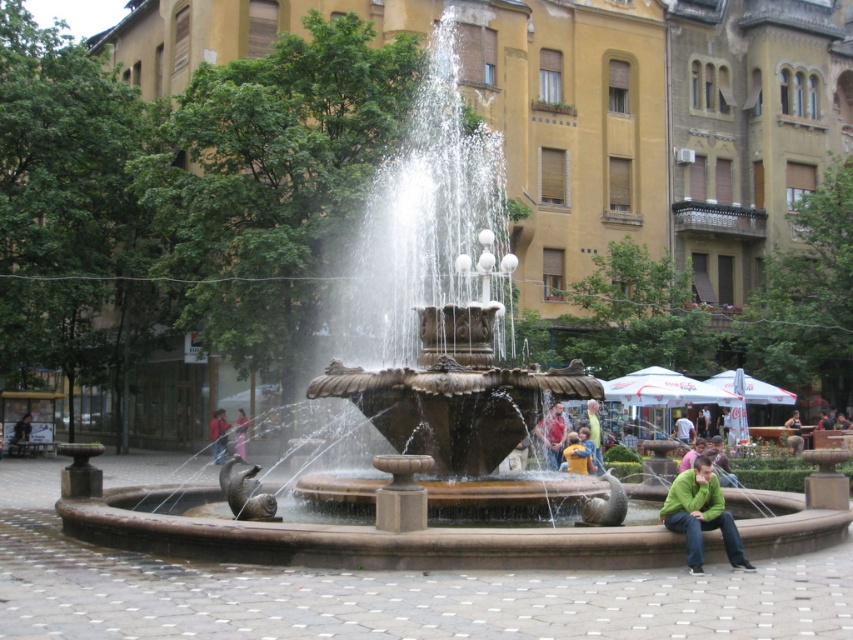
Question: Does matte brown jacket at center come in front of yellow fabric person at lower right?

Choices:
 (A) no
 (B) yes

Answer: (B)

Question: Is yellow fabric person at lower right below red fabric jacket at lower left?

Choices:
 (A) yes
 (B) no

Answer: (B)

Question: Which object is the farthest from the yellow fabric person at lower right?

Choices:
 (A) matte brown jacket at center
 (B) green matte jacket at lower right

Answer: (B)

Question: Among these objects, which one is nearest to the camera?

Choices:
 (A) green matte jacket at lower right
 (B) yellow fabric person at lower right

Answer: (A)

Question: Which point is farther to the camera?

Choices:
 (A) (225, 449)
 (B) (577, 445)
 (C) (560, 442)
 (D) (679, 477)

Answer: (A)

Question: Can you confirm if green matte jacket at lower right is positioned to the left of red fabric jacket at lower left?

Choices:
 (A) yes
 (B) no

Answer: (B)